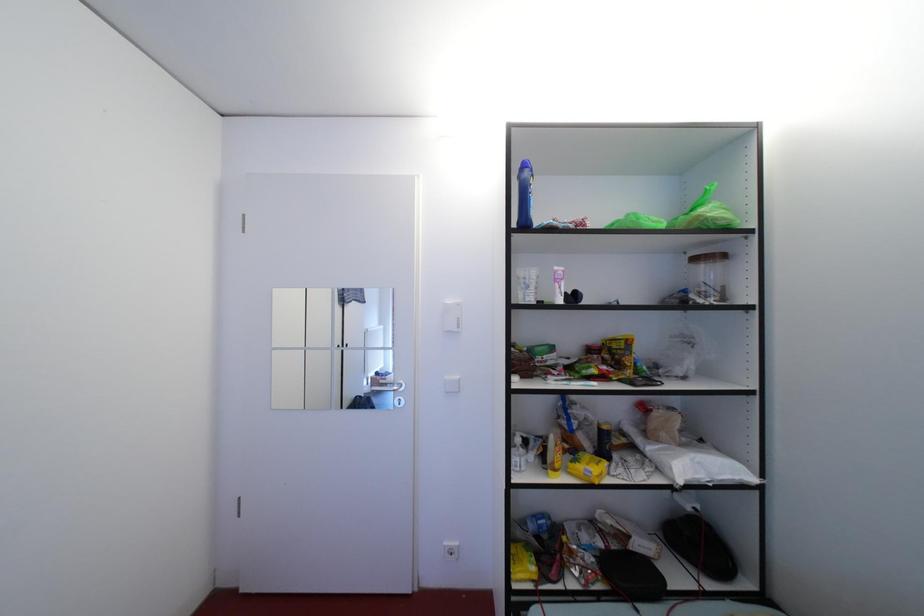
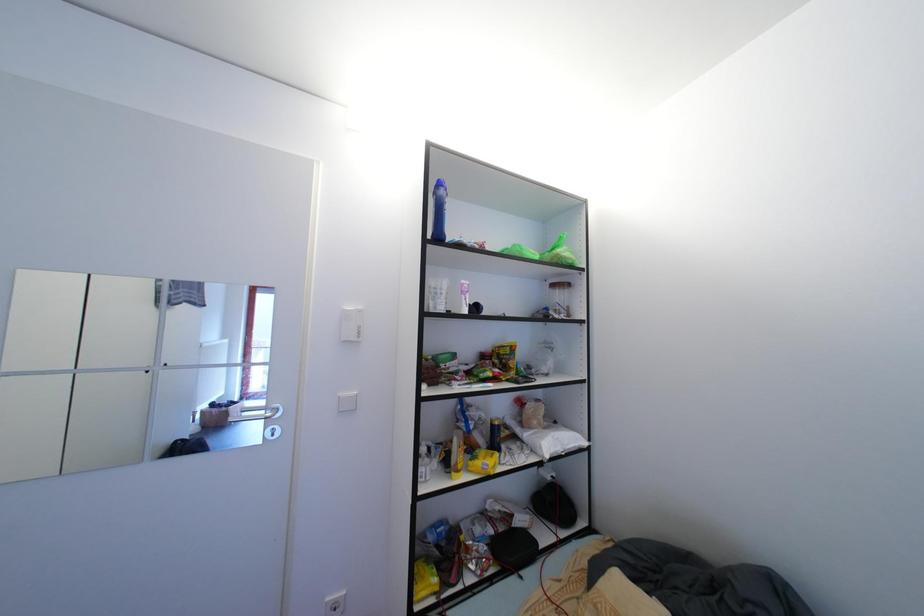
Question: The images are taken continuously from a first-person perspective. In which direction are you moving?

Choices:
 (A) Left
 (B) Right
 (C) Forward
 (D) Backward

Answer: (A)